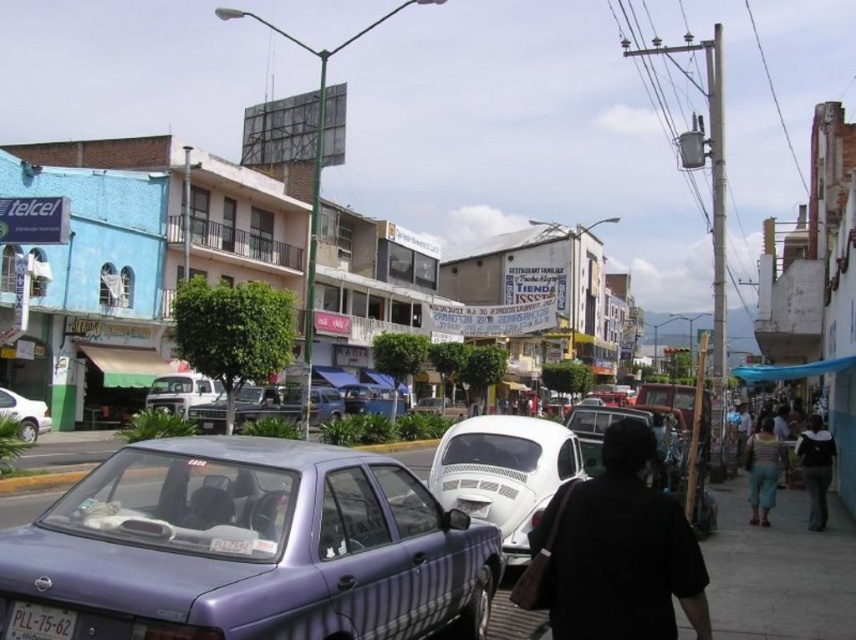
You are a fashion designer observing a passerby on the street. You notice the black matte shirt at lower right and the dark blue jeans at lower right. Which clothing item is positioned higher on the person?

The black matte shirt at lower right is located above the dark blue jeans at lower right, so the black matte shirt at lower right is positioned higher on the person.

You are driving a car and need to pass between the metallic silver truck at center and the matte white truck at center. The length of your car is 4.5 meters. Can you safely pass through the gap between them?

The gap between the metallic silver truck at center and the matte white truck at center is 5.47 meters. Since your car is 4.5 meters long, there is enough space to safely pass through the gap between them.